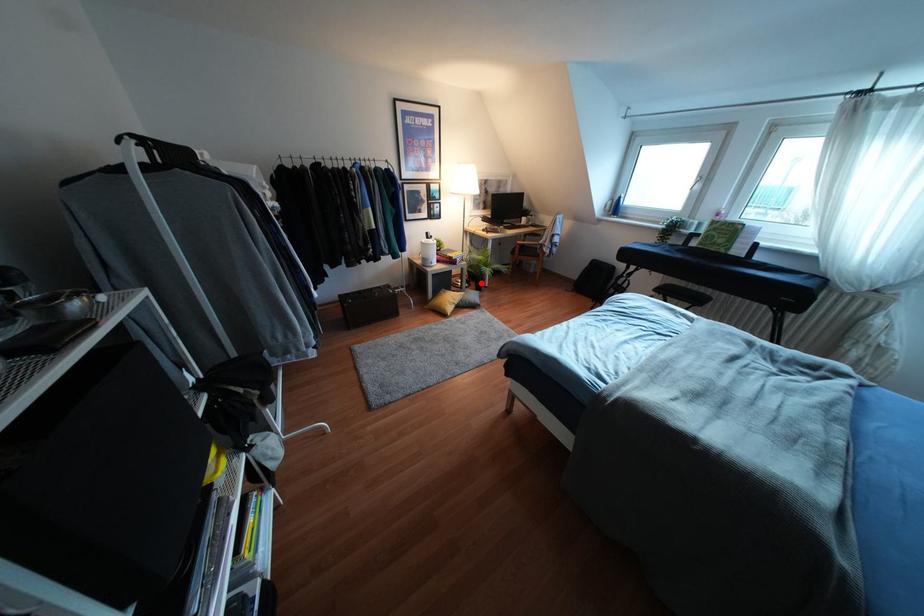
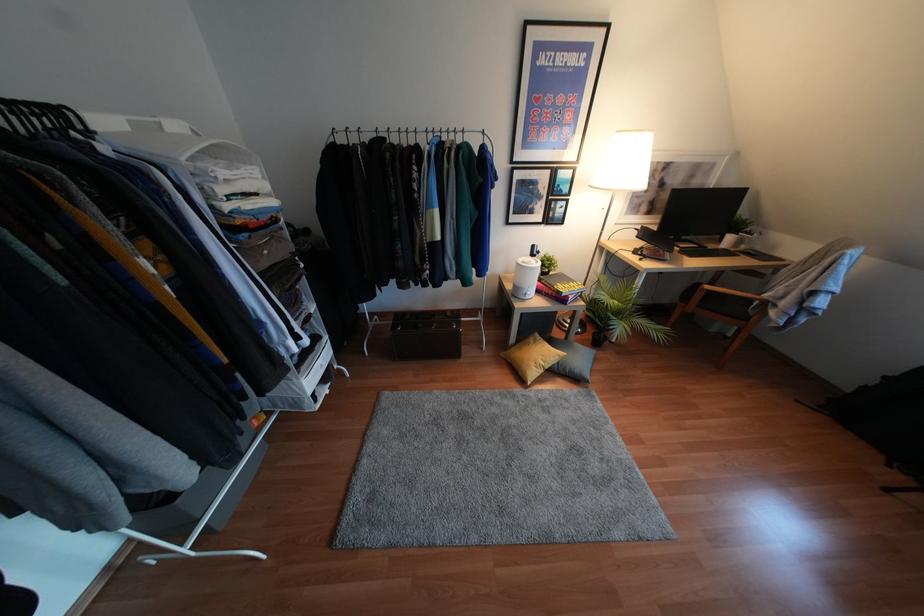
Question: I am providing you with two images of the same scene from different viewpoints. Image1 has a red point marked. In image2, the corresponding 3D location appears at what relative position? Reply with the corresponding letter.

Choices:
 (A) Closer
 (B) Farther

Answer: (A)